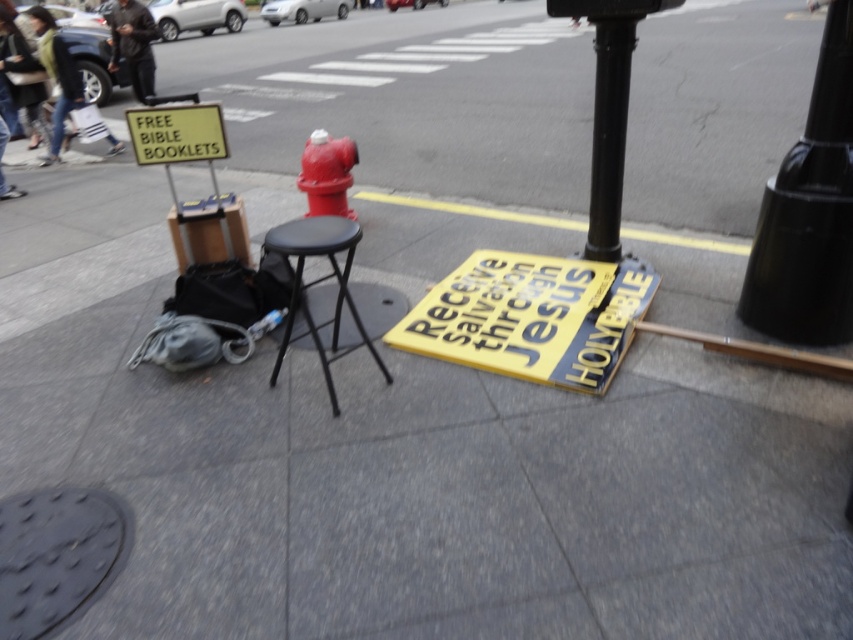
You are a pedestrian walking along the sidewalk and notice the black glossy pole at upper right and the black metal stool at center. Which object is positioned more to the east?

The black glossy pole at upper right is positioned more to the east since it is located to the right of the black metal stool at center.

What is the 2D coordinate of the glossy metal fire hydrant at center?

The glossy metal fire hydrant at center is located at the 2D coordinate point of (326,173).